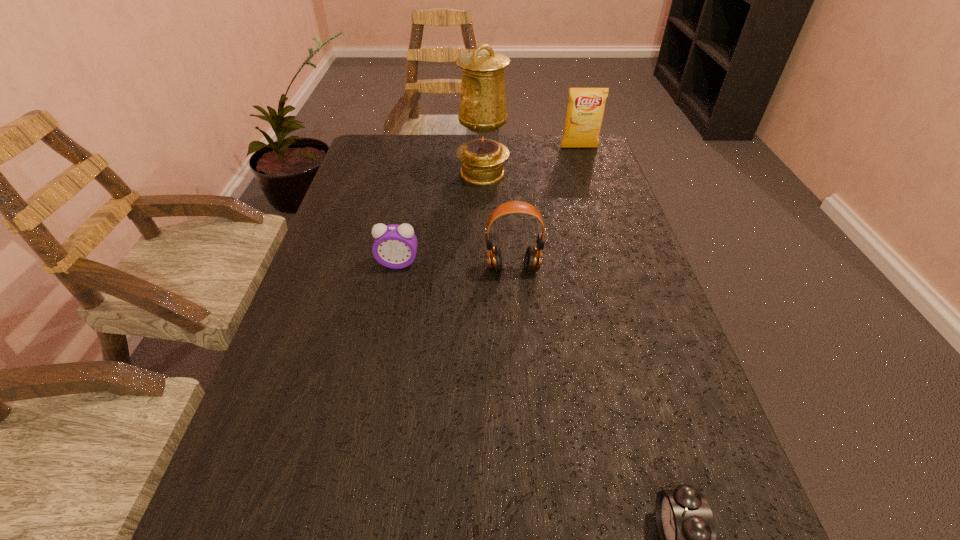
Image resolution: width=960 pixels, height=540 pixels. Identify the location of empty space between the farther alarm clock and the headset. (456, 266).

The height and width of the screenshot is (540, 960). Identify the location of free space between the farthest object and the headset. (546, 208).

The height and width of the screenshot is (540, 960). What are the coordinates of `vacant space that's between the headset and the crisp (potato chip)` in the screenshot? It's located at (546, 208).

The image size is (960, 540). Find the location of `free space between the crisp (potato chip) and the left alarm clock`. free space between the crisp (potato chip) and the left alarm clock is located at coordinates (489, 205).

Where is `vacant area that lies between the crisp (potato chip) and the leftmost object`? The width and height of the screenshot is (960, 540). vacant area that lies between the crisp (potato chip) and the leftmost object is located at coordinates (489, 205).

At what (x,y) coordinates should I click in order to perform the action: click on free spot between the headset and the crisp (potato chip). Please return your answer as a coordinate pair (x, y). This screenshot has width=960, height=540. Looking at the image, I should click on (546, 208).

At what (x,y) coordinates should I click in order to perform the action: click on free space between the headset and the tallest object. Please return your answer as a coordinate pair (x, y). This screenshot has height=540, width=960. Looking at the image, I should click on (498, 221).

At what (x,y) coordinates should I click in order to perform the action: click on object identified as the fourth closest to the crisp (potato chip). Please return your answer as a coordinate pair (x, y). Looking at the image, I should click on (685, 523).

Locate which object is the closest to the farther alarm clock. Please provide its 2D coordinates. Your answer should be formatted as a tuple, i.e. [(x, y)], where the tuple contains the x and y coordinates of a point satisfying the conditions above.

[(533, 257)]

Locate an element on the screen. The image size is (960, 540). alarm clock that is the second closest to the headset is located at coordinates (685, 523).